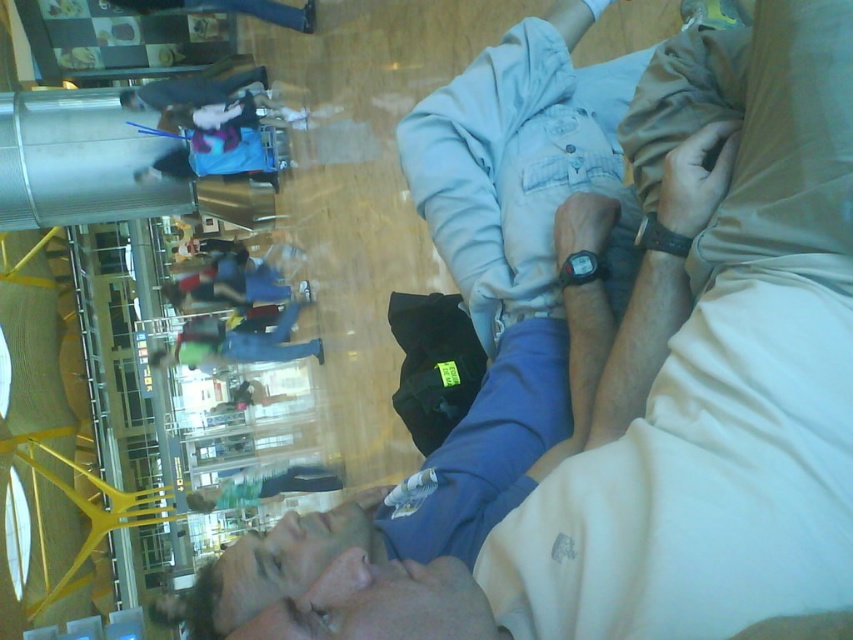
Consider the image. You are a security guard in the airport and you see the light blue fabric at center and the black plastic watch at center. Which object is closer to you?

The light blue fabric at center is closer to you because it is in front of the black plastic watch at center.

You are a photographer trying to capture a closeup of the light blue fabric at center and the black leather watch at center. Since you want to focus on both objects equally, which one should you adjust your camera angle to look up at or down at?

The light blue fabric at center is below the black leather watch at center, so you should adjust your camera angle to look down at the light blue fabric at center and up at the black leather watch at center to focus on both equally.